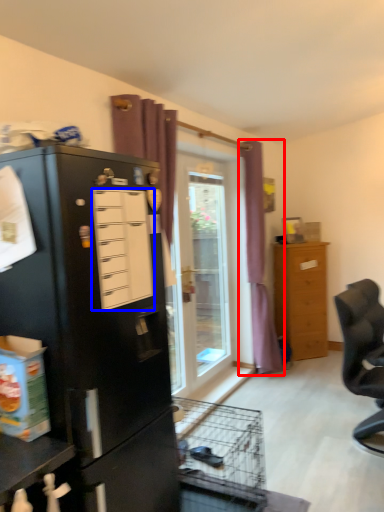
Question: Among these objects, which one is farthest to the camera, curtain (highlighted by a red box) or drawer (highlighted by a blue box)?

Choices:
 (A) curtain
 (B) drawer

Answer: (A)